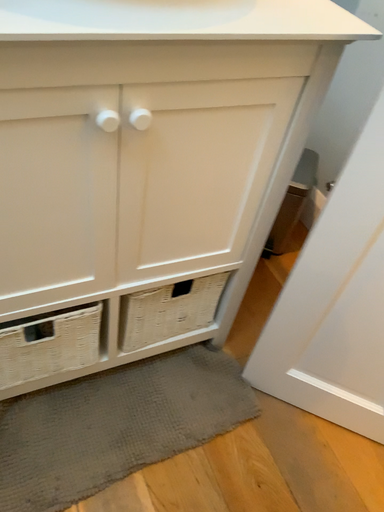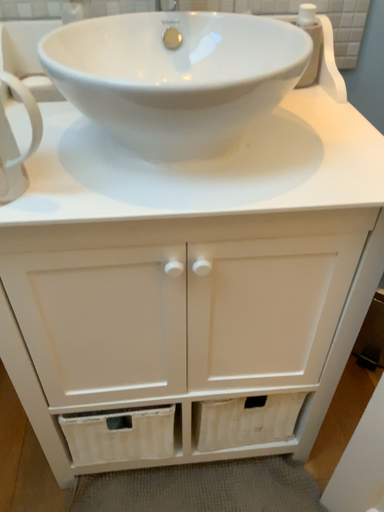
Question: Which way did the camera rotate in the video?

Choices:
 (A) rotated right
 (B) rotated left

Answer: (B)